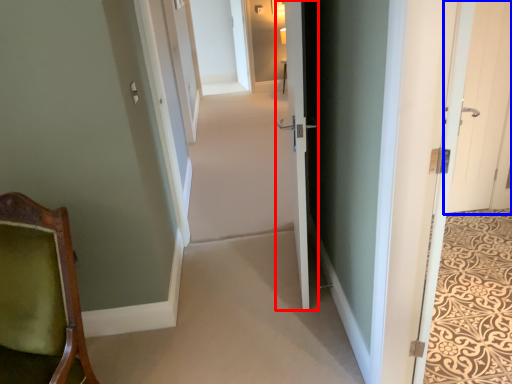
Question: Which of the following is the closest to the observer, door (highlighted by a red box) or door (highlighted by a blue box)?

Choices:
 (A) door
 (B) door

Answer: (A)